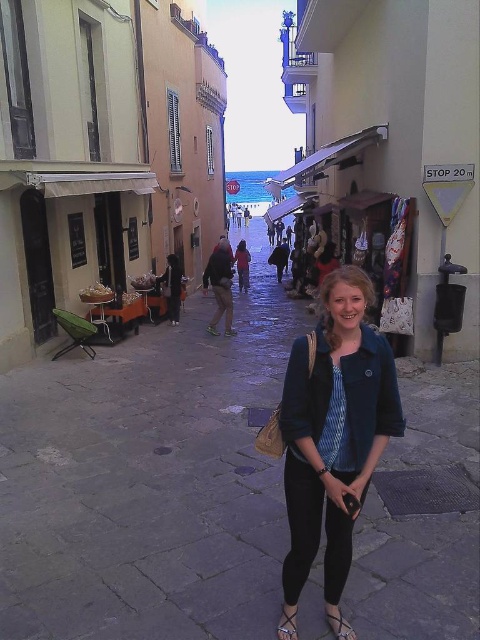
You are a tailor who needs to determine which item requires more fabric for alterations. Based on the scene, which item is wider between the denim jacket at center and the leather sandal at lower center?

The denim jacket at center is wider than the leather sandal at lower center, so it requires more fabric for alterations.